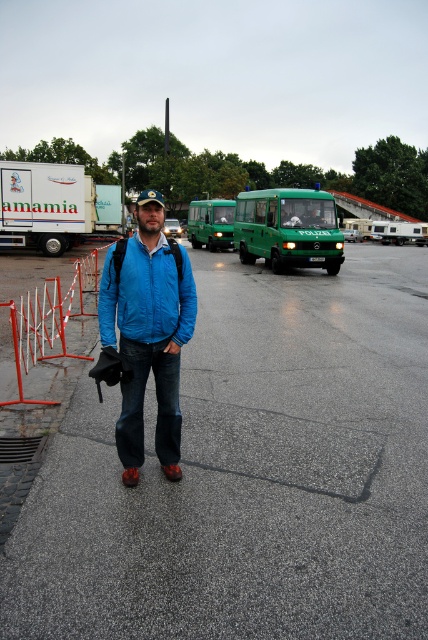
Question: Based on their relative distances, which object is nearer to the gray asphalt pavement at center?

Choices:
 (A) green matte van at center
 (B) green matte bus at center

Answer: (A)

Question: Which of the following is the farthest from the observer?

Choices:
 (A) (14, 316)
 (B) (17, 237)

Answer: (B)

Question: Does gray asphalt pavement at center have a lesser width compared to blue matte jacket at center?

Choices:
 (A) no
 (B) yes

Answer: (A)

Question: Is the position of gray asphalt pavement at center less distant than that of white matte truck at left?

Choices:
 (A) no
 (B) yes

Answer: (B)

Question: Which point is farther from the camera taking this photo?

Choices:
 (A) (202, 225)
 (B) (329, 353)

Answer: (A)

Question: Does gray asphalt pavement at center have a lesser width compared to blue matte jacket at center?

Choices:
 (A) no
 (B) yes

Answer: (A)